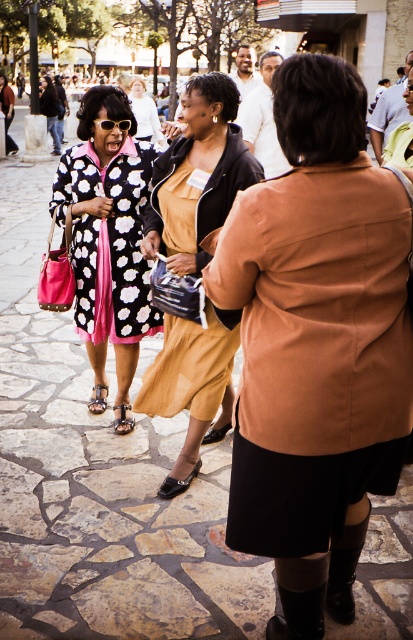
You are a photographer trying to capture a candid shot of the two central figures in the scene. Given that the matte black dress at center and the polka dot coat at center are both in focus, which one would appear smaller in the photo?

The matte black dress at center would appear smaller in the photo because it occupies less space than the polka dot coat at center.